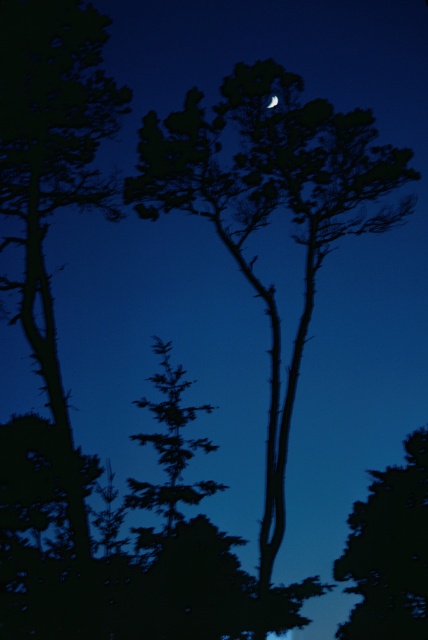
Question: Does dark green leafy tree at left appear on the left side of silhouette bark tree at right?

Choices:
 (A) no
 (B) yes

Answer: (B)

Question: Is dark green leafy tree at left positioned in front of silvery reflective moon at upper center?

Choices:
 (A) no
 (B) yes

Answer: (B)

Question: Based on their relative distances, which object is nearer to the silvery reflective moon at upper center?

Choices:
 (A) dark green leafy tree at left
 (B) silhouette bark tree at right

Answer: (A)

Question: Is dark green leafy tree at left bigger than silhouette bark tree at right?

Choices:
 (A) yes
 (B) no

Answer: (A)

Question: Which of the following is the farthest from the observer?

Choices:
 (A) silvery reflective moon at upper center
 (B) silhouette bark tree at right
 (C) dark green leafy tree at left

Answer: (A)

Question: Which object is closer to the camera taking this photo?

Choices:
 (A) dark green leafy tree at left
 (B) silhouette bark tree at right

Answer: (A)